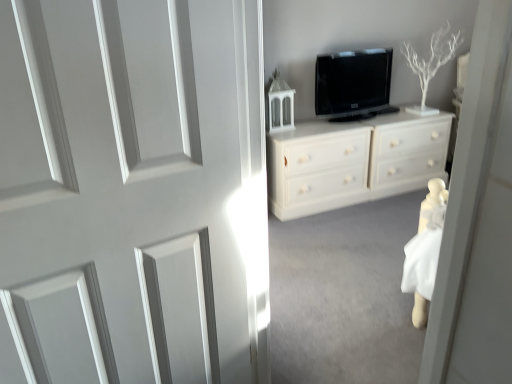
Identify the location of empty space that is to the right of black glossy tv at upper center. This screenshot has width=512, height=384. (385, 114).